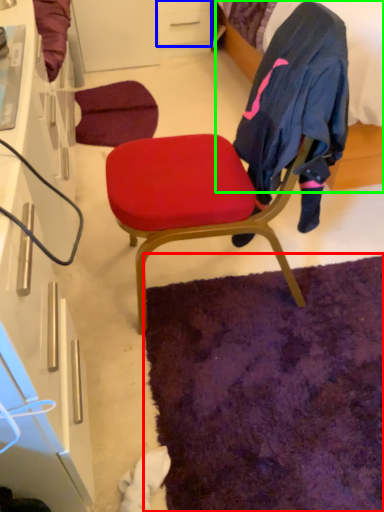
Question: Which object is positioned closest to mat (highlighted by a red box)? Select from drawer (highlighted by a blue box) and bed (highlighted by a green box).

Choices:
 (A) drawer
 (B) bed

Answer: (B)